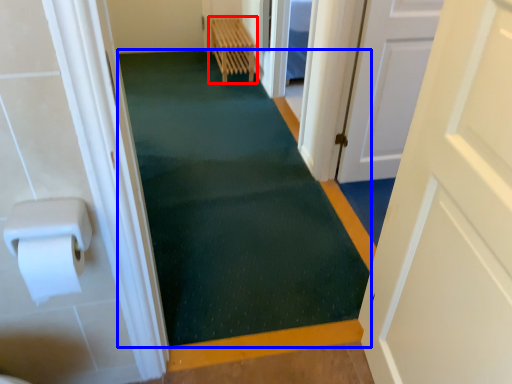
Question: Which of the following is the farthest to the observer, furniture (highlighted by a red box) or bath mat (highlighted by a blue box)?

Choices:
 (A) furniture
 (B) bath mat

Answer: (A)